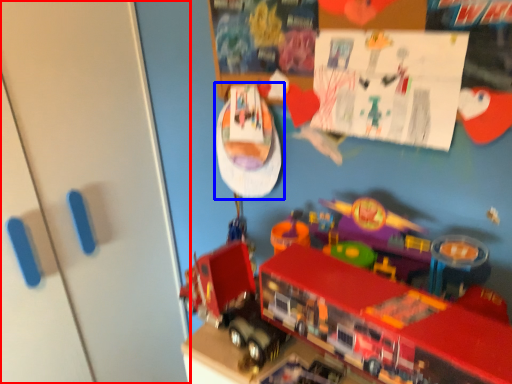
Question: Which point is further to the camera, door (highlighted by a red box) or toy (highlighted by a blue box)?

Choices:
 (A) door
 (B) toy

Answer: (B)